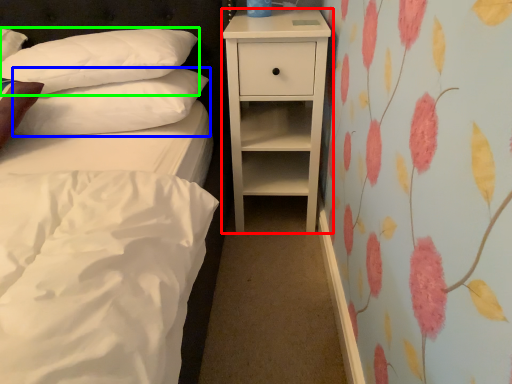
Question: Which is farther away from nightstand (highlighted by a red box)? pillow (highlighted by a blue box) or pillow (highlighted by a green box)?

Choices:
 (A) pillow
 (B) pillow

Answer: (B)